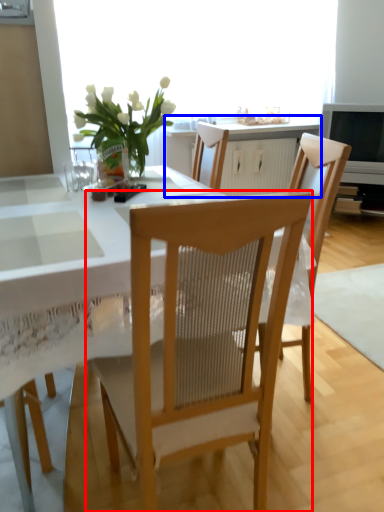
Question: Which point is further to the camera, chair (highlighted by a red box) or cabinetry (highlighted by a blue box)?

Choices:
 (A) chair
 (B) cabinetry

Answer: (B)